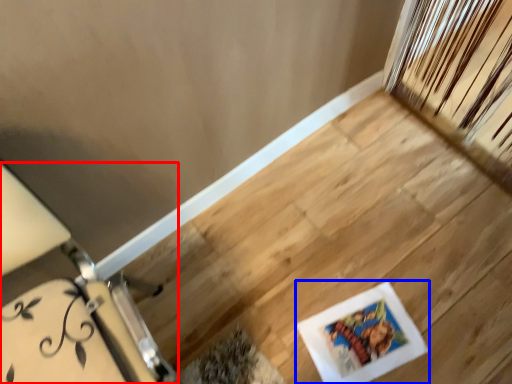
Question: Which point is closer to the camera, furniture (highlighted by a red box) or picture frame (highlighted by a blue box)?

Choices:
 (A) furniture
 (B) picture frame

Answer: (A)